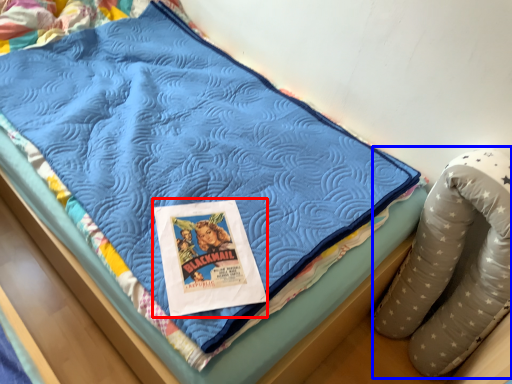
Question: Which object appears farthest to the camera in this image, comic book (highlighted by a red box) or bean bag chair (highlighted by a blue box)?

Choices:
 (A) comic book
 (B) bean bag chair

Answer: (A)